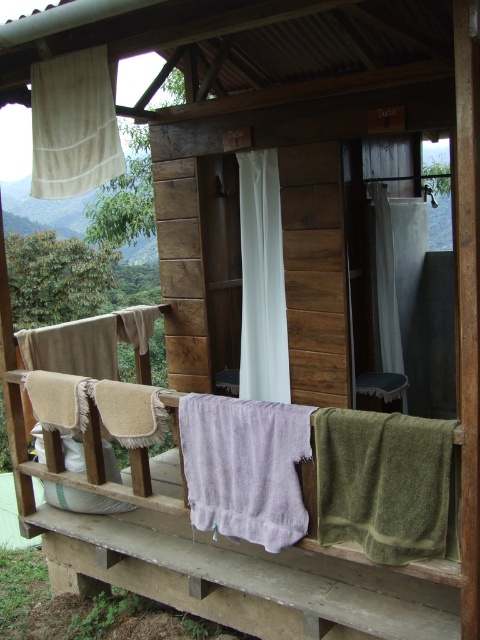
You are a guest staying at this rustic mountain cabin and need to determine which curtain to use to cover the entrance. The white fabric curtain at center and the white sheer curtain at center are both available. Which one would block more light and provide more privacy?

The white sheer curtain at center is larger in size, so it would block more light and provide more privacy than the white fabric curtain at center.

You are standing inside the rustic bathroom and want to find the shower area. You see the beige fabric curtain at upper left and the white sheer curtain at center. Which curtain is closer to the left side of the bathroom?

The beige fabric curtain at upper left is closer to the left side of the bathroom because it is positioned on the left side of the white sheer curtain at center.